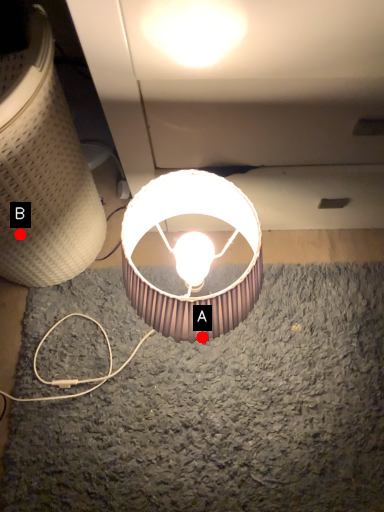
Question: Two points are circled on the image, labeled by A and B beside each circle. Which point is further to the camera?

Choices:
 (A) A is further
 (B) B is further

Answer: (B)